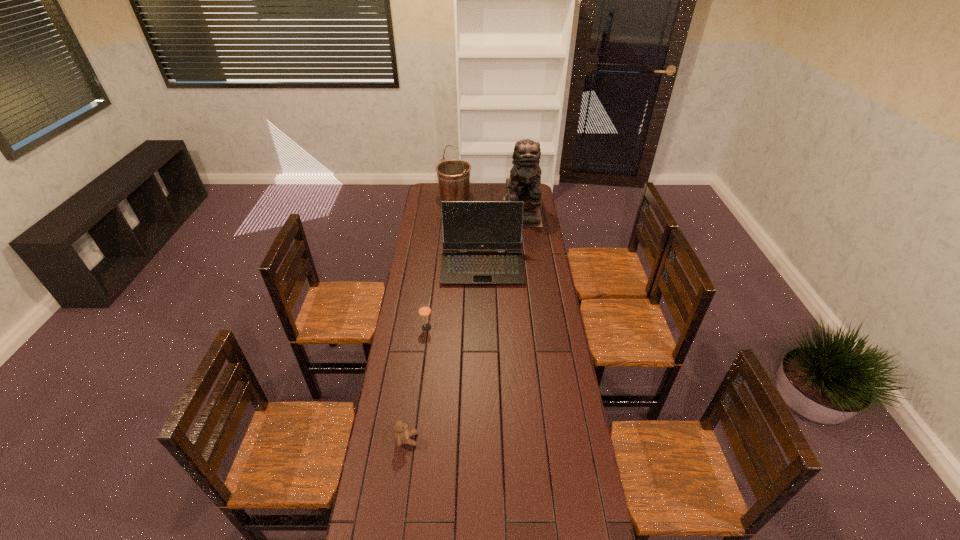
At what (x,y) coordinates should I click in order to perform the action: click on the tallest object. Please return your answer as a coordinate pair (x, y). The image size is (960, 540). Looking at the image, I should click on (524, 182).

Where is `the fourth shortest object`? the fourth shortest object is located at coordinates (453, 176).

Locate an element on the screen. the third shortest object is located at coordinates (466, 225).

Image resolution: width=960 pixels, height=540 pixels. I want to click on laptop computer, so click(x=466, y=225).

You are a GUI agent. You are given a task and a screenshot of the screen. Output one action in this format:
    pyautogui.click(x=<x>, y=<y>)
    Task: Click on the fourth farthest object
    The width and height of the screenshot is (960, 540).
    Given the screenshot: What is the action you would take?
    pyautogui.click(x=424, y=310)

Where is `the second shortest object`? Image resolution: width=960 pixels, height=540 pixels. the second shortest object is located at coordinates click(x=424, y=310).

I want to click on the nearest object, so click(402, 434).

At what (x,y) coordinates should I click in order to perform the action: click on teddy bear. Please return your answer as a coordinate pair (x, y). This screenshot has height=540, width=960. Looking at the image, I should click on (402, 434).

Where is `vacant space located 0.180m on the front-facing side of the tallest object`? The height and width of the screenshot is (540, 960). vacant space located 0.180m on the front-facing side of the tallest object is located at coordinates tap(527, 246).

The image size is (960, 540). What are the coordinates of `free space located on the front of the fourth shortest object` in the screenshot? It's located at (452, 235).